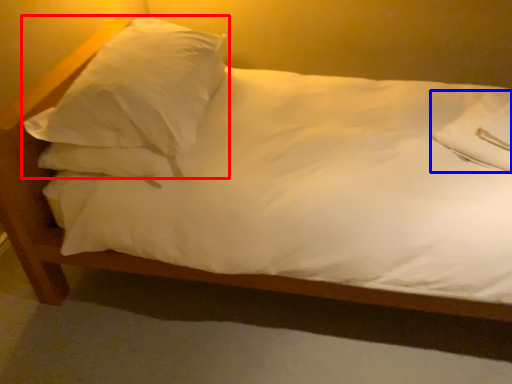
Question: Which point is further to the camera, pillow (highlighted by a red box) or pillow (highlighted by a blue box)?

Choices:
 (A) pillow
 (B) pillow

Answer: (B)